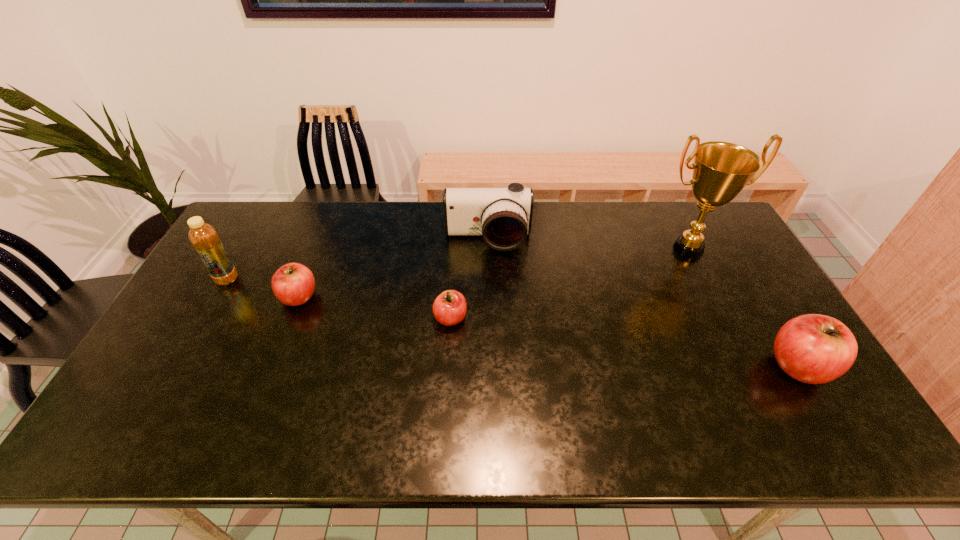
Locate an element on the screen. The image size is (960, 540). free space that is in between the tallest object and the tallest apple is located at coordinates click(744, 307).

Find the location of a particular element. empty space between the camcorder and the award is located at coordinates (588, 244).

At what (x,y) coordinates should I click in order to perform the action: click on free space between the bottle and the nearest apple. Please return your answer as a coordinate pair (x, y). Looking at the image, I should click on (514, 323).

Image resolution: width=960 pixels, height=540 pixels. Find the location of `blank region between the shortest apple and the bottle`. blank region between the shortest apple and the bottle is located at coordinates (339, 299).

At what (x,y) coordinates should I click in order to perform the action: click on free point between the tallest object and the second apple from right to left. Please return your answer as a coordinate pair (x, y). The height and width of the screenshot is (540, 960). Looking at the image, I should click on (569, 283).

Identify the location of free area in between the fifth object from right to left and the tallest apple. The image size is (960, 540). click(549, 332).

Where is `vacant point located between the bottle and the camcorder`? Image resolution: width=960 pixels, height=540 pixels. vacant point located between the bottle and the camcorder is located at coordinates (357, 260).

Identify the location of free space between the tallest object and the second tallest object. (458, 264).

You are a GUI agent. You are given a task and a screenshot of the screen. Output one action in this format:
    pyautogui.click(x=<x>, y=<y>)
    Task: Click on the vacant space that's between the leftmost apple and the fifth shortest object
    
    Given the screenshot: What is the action you would take?
    pyautogui.click(x=263, y=288)

Locate an element on the screen. The height and width of the screenshot is (540, 960). free space between the fifth shortest object and the nearest object is located at coordinates (514, 323).